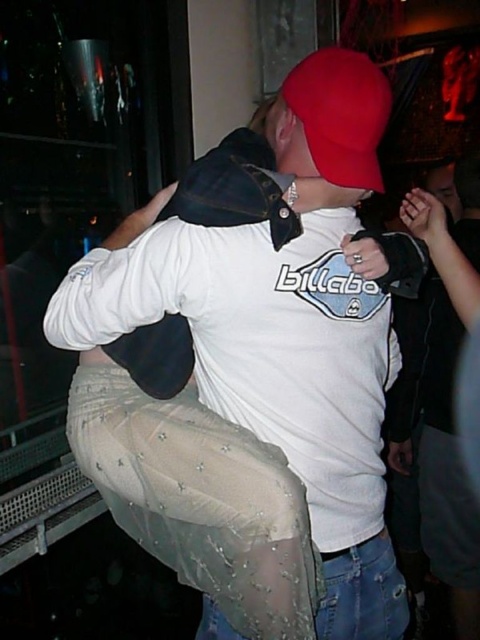
Question: Does white matte shirt at center have a greater width compared to red matte baseball hat at upper center?

Choices:
 (A) yes
 (B) no

Answer: (A)

Question: Is white matte shirt at center wider than red matte baseball hat at upper center?

Choices:
 (A) yes
 (B) no

Answer: (A)

Question: Is white matte shirt at center positioned at the back of red matte baseball hat at upper center?

Choices:
 (A) yes
 (B) no

Answer: (A)

Question: Which of the following is the farthest from the observer?

Choices:
 (A) (383, 122)
 (B) (178, 339)

Answer: (B)